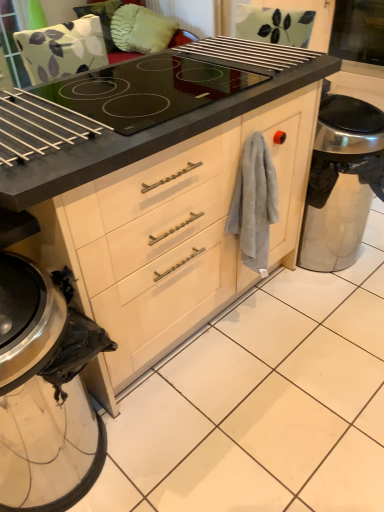
Question: Relative to metallic silver trash can at lower left, is satin silver trash can at lower right in front or behind?

Choices:
 (A) front
 (B) behind

Answer: (B)

Question: From their relative heights in the image, would you say satin silver trash can at lower right is taller or shorter than metallic silver trash can at lower left?

Choices:
 (A) short
 (B) tall

Answer: (A)

Question: Considering the real-world distances, which object is closest to the gray cotton towel at right?

Choices:
 (A) transparent glass screen door at upper right
 (B) satin silver trash can at lower right
 (C) metallic silver trash can at lower left

Answer: (B)

Question: Estimate the real-world distances between objects in this image. Which object is closer to the metallic silver trash can at lower left?

Choices:
 (A) gray cotton towel at right
 (B) satin silver trash can at lower right
 (C) transparent glass screen door at upper right

Answer: (A)